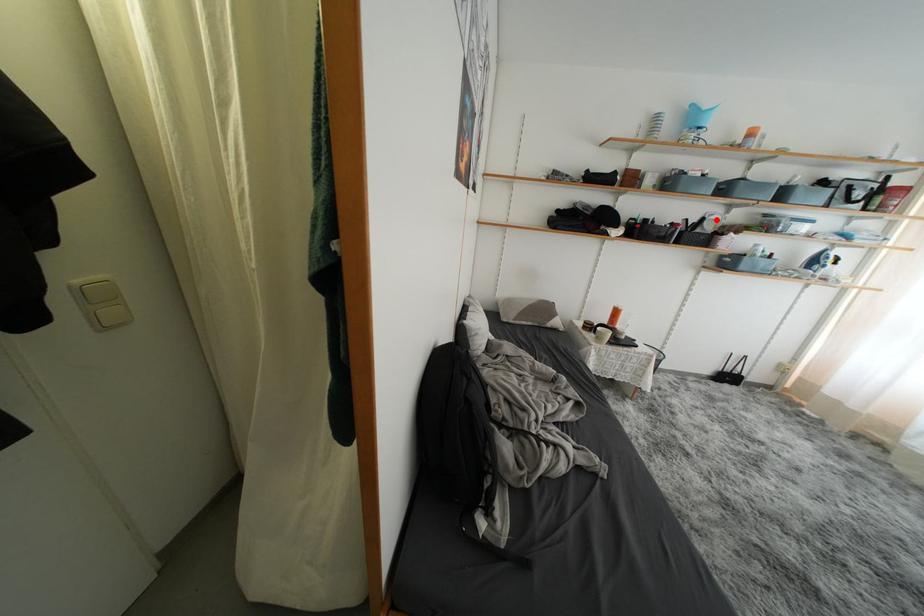
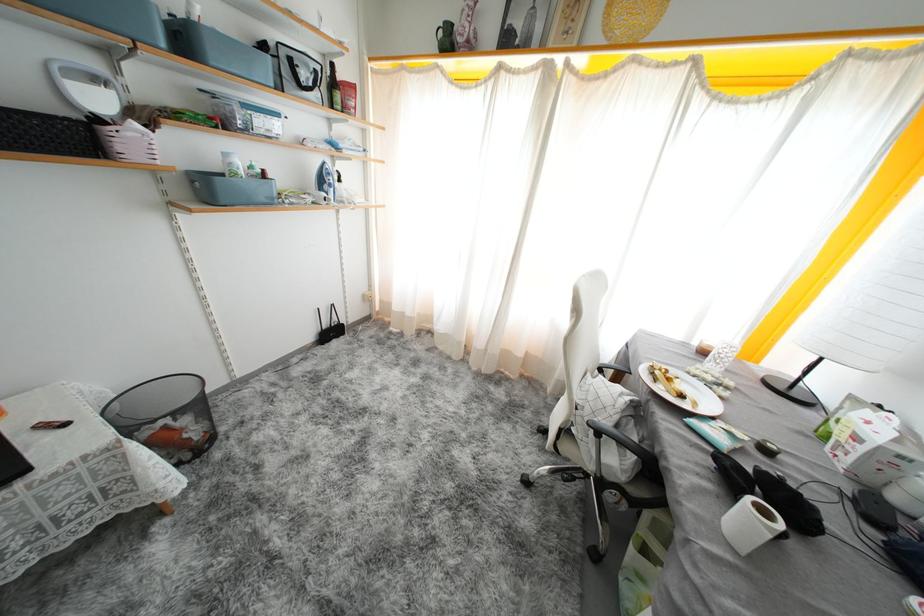
Question: A red point is marked in image1. In image2, is the corresponding 3D point closer to the camera or farther? Reply with the corresponding letter.

Choices:
 (A) The corresponding 3D point is closer.
 (B) The corresponding 3D point is farther.

Answer: (B)